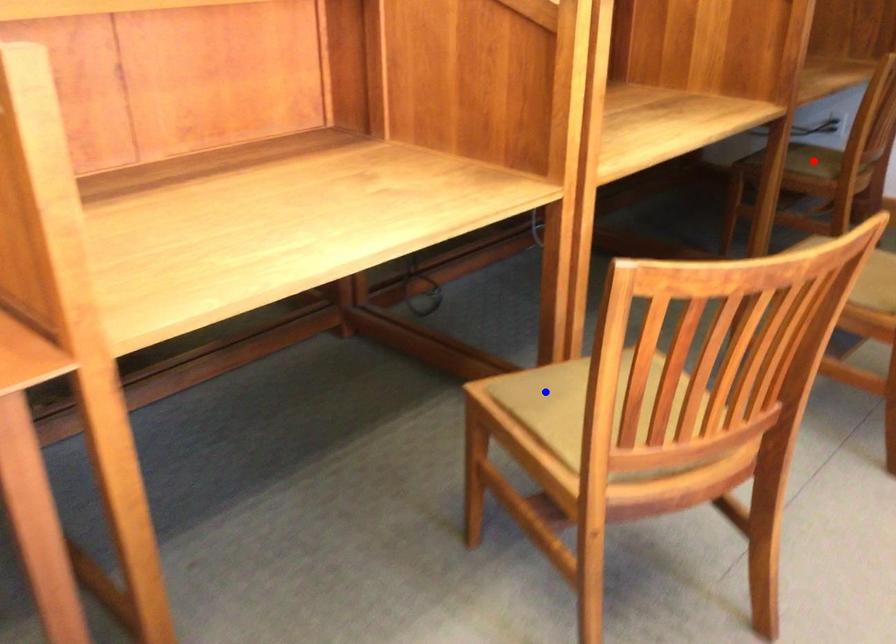
Question: Which of the two points in the image is closer to the camera?

Choices:
 (A) Blue point is closer.
 (B) Red point is closer.

Answer: (A)